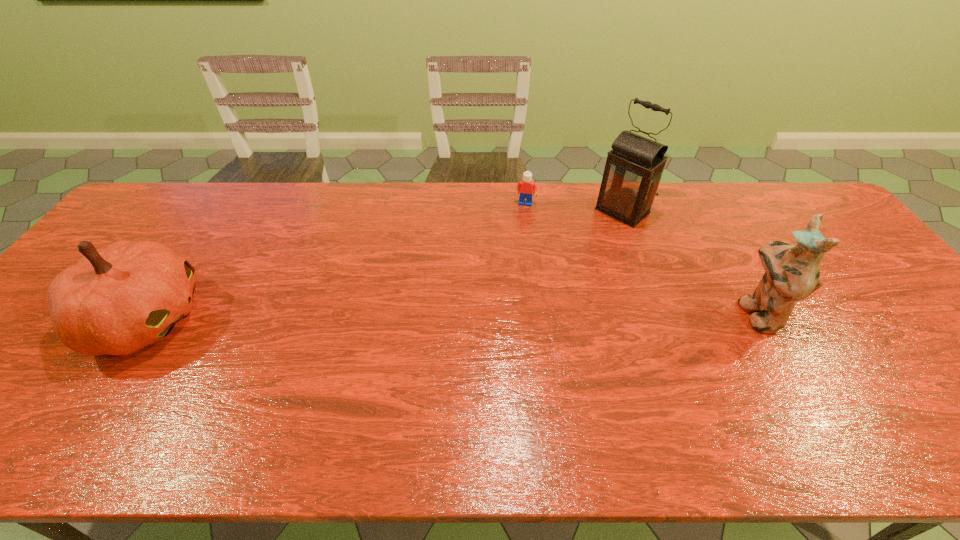
Where is `vacant space on the desktop that is between the third tallest object and the rightmost object and is positioned on the face of the shortest object`? The height and width of the screenshot is (540, 960). vacant space on the desktop that is between the third tallest object and the rightmost object and is positioned on the face of the shortest object is located at coordinates (504, 315).

This screenshot has height=540, width=960. In order to click on free space on the desktop that is between the leftmost object and the rightmost object and is positioned on the front-facing side of the lantern in this screenshot , I will do `click(500, 315)`.